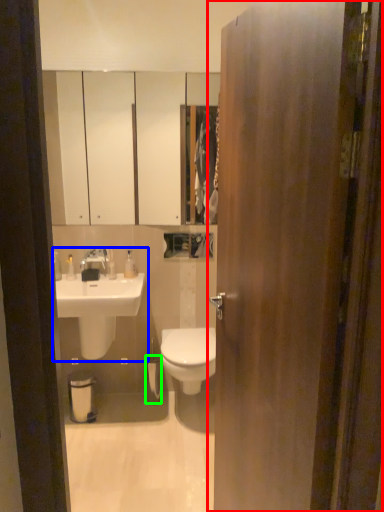
Question: Estimate the real-world distances between objects in this image. Which object is closer to door (highlighted by a red box), sink (highlighted by a blue box) or toilet paper (highlighted by a green box)?

Choices:
 (A) sink
 (B) toilet paper

Answer: (A)